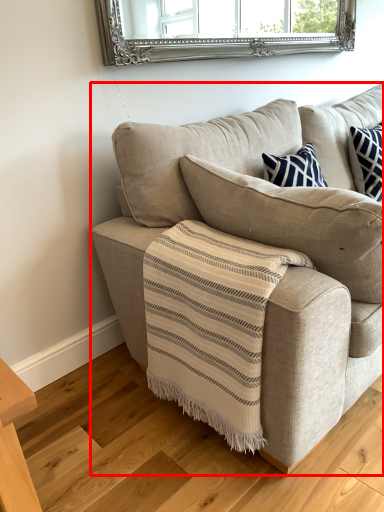
Question: Where is studio couch (annotated by the red box) located in relation to stair in the image?

Choices:
 (A) right
 (B) left

Answer: (A)